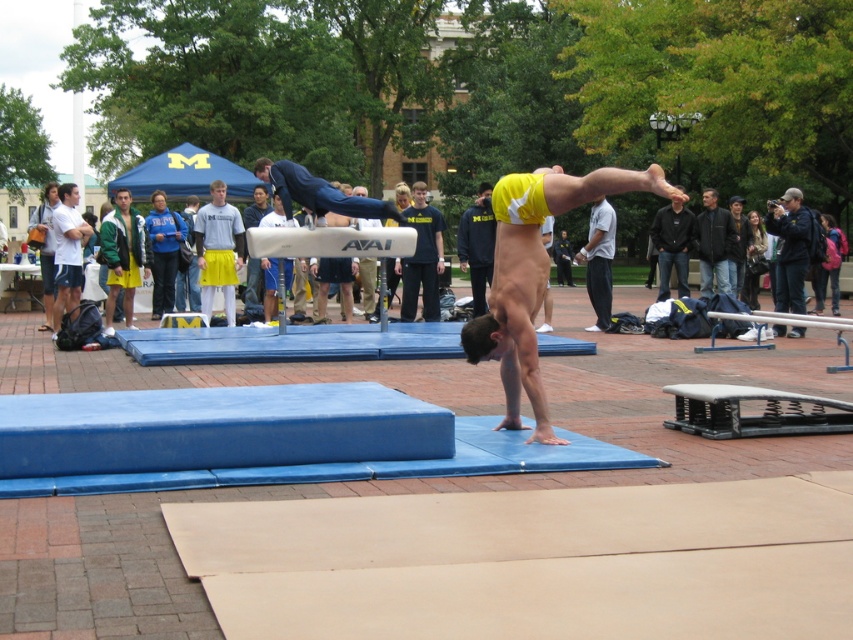
Who is taller, blue foam mat at lower center or blue jacket at upper right?

blue jacket at upper right is taller.

Between blue foam mat at lower center and blue jacket at upper right, which one appears on the left side from the viewer's perspective?

blue foam mat at lower center is more to the left.

The image size is (853, 640). Identify the location of blue foam mat at lower center. (216, 428).

Between point (125, 262) and point (463, 234), which one is positioned in front?

Point (125, 262) is in front.

The image size is (853, 640). What do you see at coordinates (123, 257) in the screenshot?
I see `green/yellow jacket at left` at bounding box center [123, 257].

Which is behind, point (119, 250) or point (474, 275)?

The point (474, 275) is more distant.

Find the location of a particular element. green/yellow jacket at left is located at coordinates (123, 257).

Is gray cotton shirt at center taller than dark gray jacket at center?

Yes, gray cotton shirt at center is taller than dark gray jacket at center.

This screenshot has height=640, width=853. What do you see at coordinates (599, 260) in the screenshot?
I see `gray cotton shirt at center` at bounding box center [599, 260].

I want to click on gray cotton shirt at center, so click(599, 260).